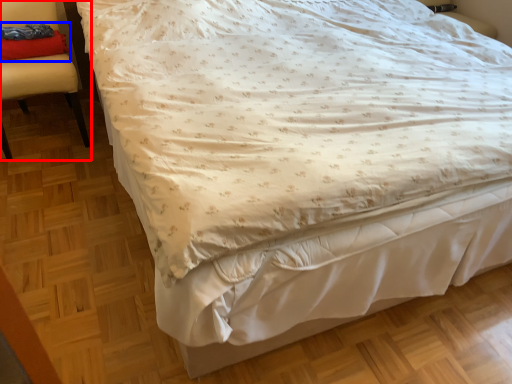
Question: Which of the following is the closest to the observer, chair (highlighted by a red box) or pillow (highlighted by a blue box)?

Choices:
 (A) chair
 (B) pillow

Answer: (A)